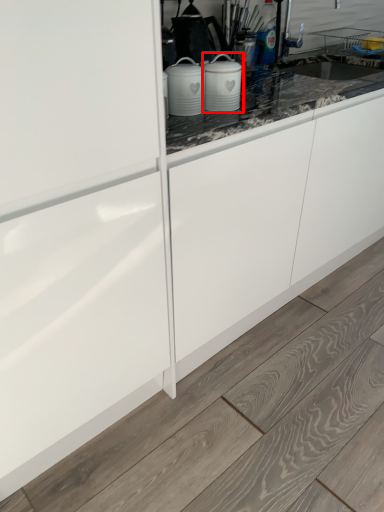
Question: Where is kitchen appliance (annotated by the red box) located in relation to home appliance in the image?

Choices:
 (A) left
 (B) right

Answer: (B)